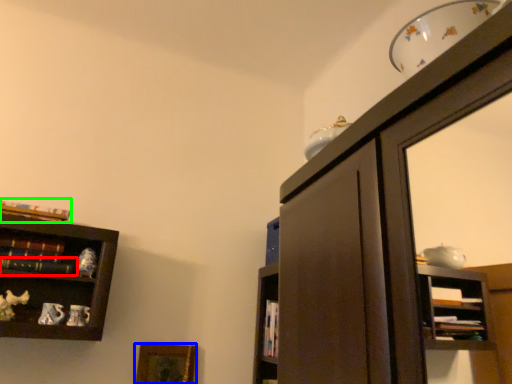
Question: Considering the real-world distances, which object is closest to book (highlighted by a red box)? picture frame (highlighted by a blue box) or book (highlighted by a green box).

Choices:
 (A) picture frame
 (B) book

Answer: (B)